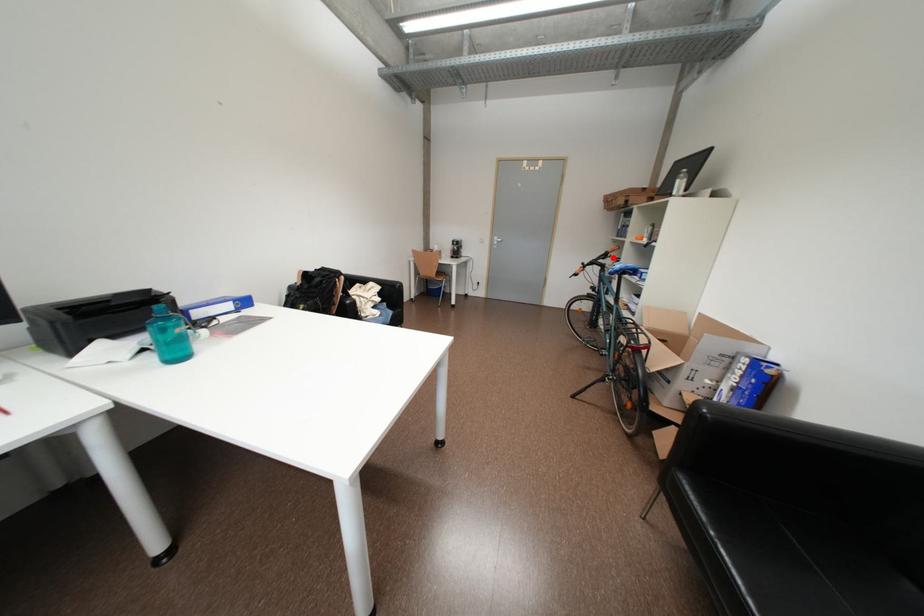
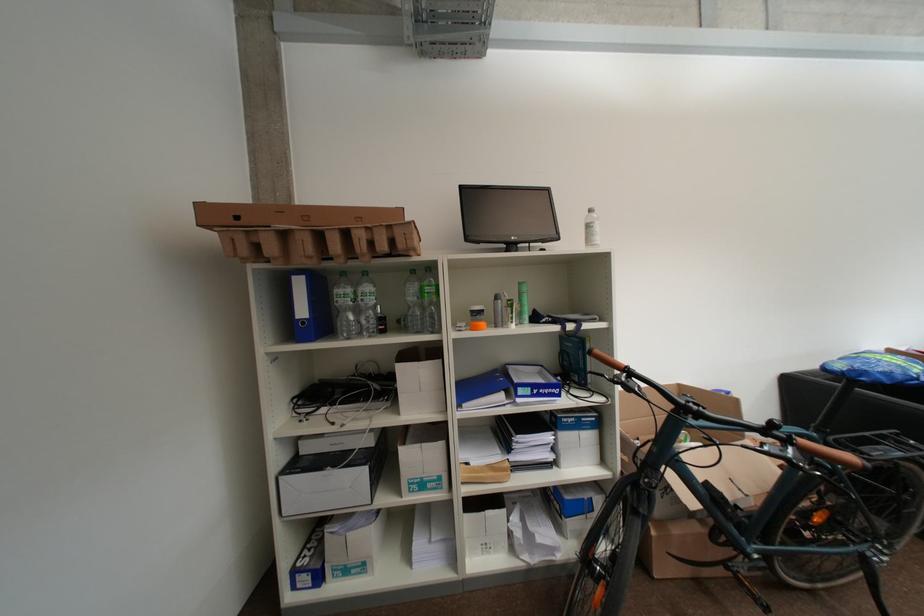
The point at the highlighted location is marked in the first image. Where is the corresponding point in the second image?

(638, 382)